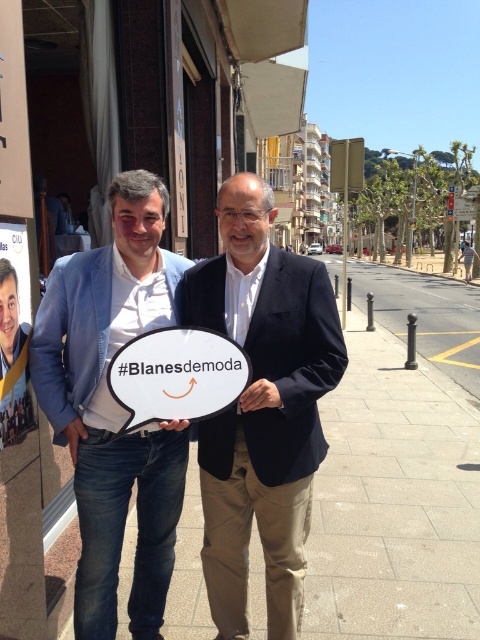
Question: Can you confirm if white concrete pavement at center is positioned to the right of blue denim jeans at lower left?

Choices:
 (A) yes
 (B) no

Answer: (A)

Question: Which point is farther to the camera?

Choices:
 (A) (374, 413)
 (B) (90, 518)
 (C) (206, 452)

Answer: (A)

Question: Does white concrete pavement at center appear under blue denim jeans at lower left?

Choices:
 (A) no
 (B) yes

Answer: (A)

Question: Which of the following is the closest to the observer?

Choices:
 (A) (123, 545)
 (B) (148, 234)

Answer: (B)

Question: Observing the image, what is the correct spatial positioning of white concrete pavement at center in reference to blue denim jeans at lower left?

Choices:
 (A) left
 (B) right

Answer: (B)

Question: Which point appears farthest from the camera in this image?

Choices:
 (A) (200, 422)
 (B) (172, 284)

Answer: (B)